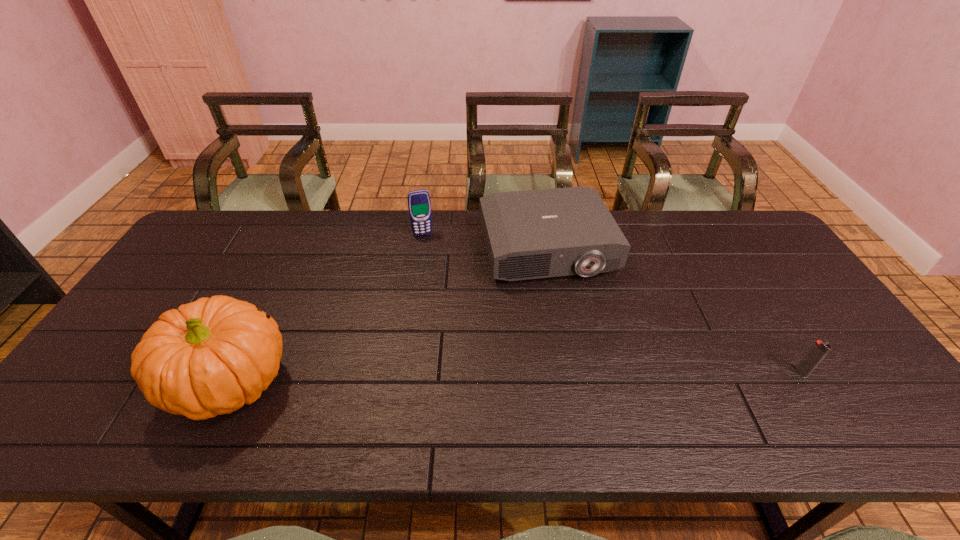
The image size is (960, 540). Identify the location of the tallest object. (212, 356).

The height and width of the screenshot is (540, 960). I want to click on the leftmost object, so click(212, 356).

The image size is (960, 540). What are the coordinates of `the rightmost object` in the screenshot? It's located at (819, 350).

The width and height of the screenshot is (960, 540). Find the location of `cellular telephone`. cellular telephone is located at coordinates (419, 205).

Find the location of `the second tallest object`. the second tallest object is located at coordinates (419, 205).

Where is `projector`? The height and width of the screenshot is (540, 960). projector is located at coordinates (532, 234).

Find the location of a particular element. The height and width of the screenshot is (540, 960). free location located 0.350m on the surface of the pumpkin is located at coordinates (439, 382).

Locate an element on the screen. This screenshot has width=960, height=540. vacant space located on the back of the igniter is located at coordinates [766, 315].

This screenshot has height=540, width=960. What are the coordinates of `free region located 0.060m on the front-facing side of the cellular telephone` in the screenshot? It's located at (428, 248).

At what (x,y) coordinates should I click in order to perform the action: click on free space located on the front-facing side of the cellular telephone. Please return your answer as a coordinate pair (x, y). This screenshot has height=540, width=960. Looking at the image, I should click on (434, 271).